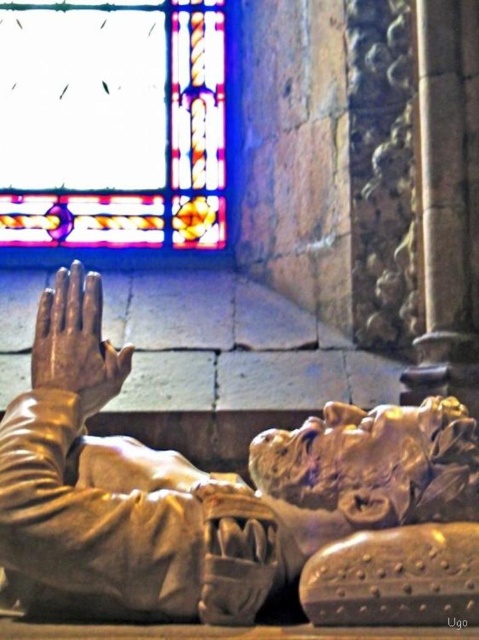
Question: Is stained glass window at upper left further to camera compared to gold metallic hand at center?

Choices:
 (A) no
 (B) yes

Answer: (B)

Question: Which point is farther to the camera?

Choices:
 (A) (343, 508)
 (B) (38, 305)
 (C) (32, 134)

Answer: (C)

Question: Can you confirm if gold polished statue at center is thinner than stained glass window at upper left?

Choices:
 (A) yes
 (B) no

Answer: (A)

Question: Which object is positioned closest to the gold metallic hand at center?

Choices:
 (A) gold polished statue at center
 (B) stained glass window at upper left

Answer: (A)

Question: Which of the following is the farthest from the observer?

Choices:
 (A) stained glass window at upper left
 (B) gold polished statue at center

Answer: (A)

Question: Can you confirm if gold polished statue at center is positioned below gold metallic hand at center?

Choices:
 (A) yes
 (B) no

Answer: (A)